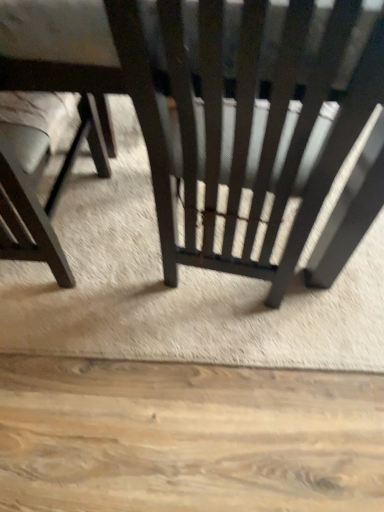
Question: Which is correct: matte black chair at left, the 1th chair from the left, is inside matte black chair at center, the 1th chair positioned from the right, or outside of it?

Choices:
 (A) outside
 (B) inside

Answer: (B)

Question: Is matte black chair at left, arranged as the 2th chair when viewed from the right, in front of or behind matte black chair at center, the 2th chair viewed from the left, in the image?

Choices:
 (A) front
 (B) behind

Answer: (B)

Question: In the image, is matte black chair at left, arranged as the 2th chair when viewed from the right, on the left side or the right side of matte black chair at center, the 2th chair viewed from the left?

Choices:
 (A) right
 (B) left

Answer: (B)

Question: Is matte black chair at center, the 2th chair viewed from the left, taller or shorter than matte black chair at left, arranged as the 2th chair when viewed from the right?

Choices:
 (A) tall
 (B) short

Answer: (A)

Question: Is matte black chair at center, the 1th chair positioned from the right, in front of or behind matte black chair at left, arranged as the 2th chair when viewed from the right, in the image?

Choices:
 (A) behind
 (B) front

Answer: (B)

Question: From the image's perspective, is matte black chair at center, the 2th chair viewed from the left, located above or below matte black chair at left, the 1th chair from the left?

Choices:
 (A) above
 (B) below

Answer: (A)

Question: Looking at the image, does matte black chair at center, the 2th chair viewed from the left, seem bigger or smaller compared to matte black chair at left, the 1th chair from the left?

Choices:
 (A) big
 (B) small

Answer: (A)